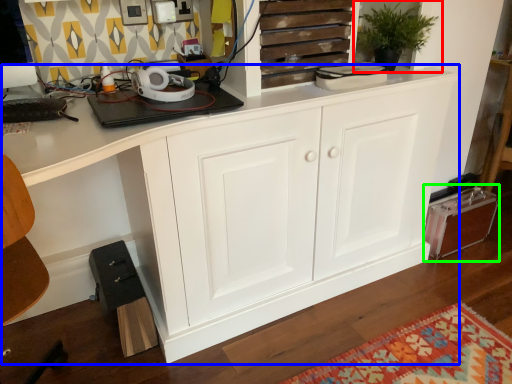
Question: Which object is positioned farthest from houseplant (highlighted by a red box)? Select from cabinetry (highlighted by a blue box) and cabinetry (highlighted by a green box).

Choices:
 (A) cabinetry
 (B) cabinetry

Answer: (B)